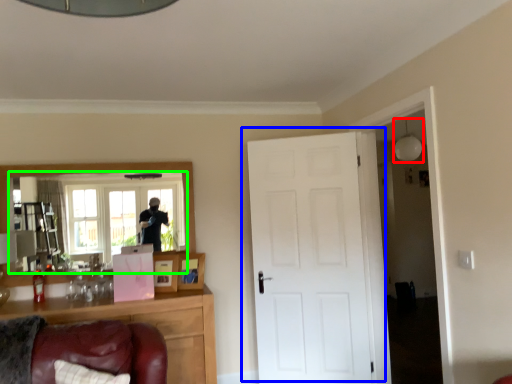
Question: Based on their relative distances, which object is nearer to light fixture (highlighted by a red box)? Choose from door (highlighted by a blue box) and mirror (highlighted by a green box).

Choices:
 (A) door
 (B) mirror

Answer: (A)